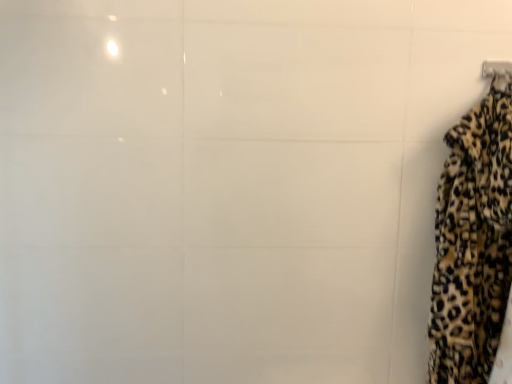
Question: Does leopard print fabric at right have a greater width compared to metallic silver hanger at upper right?

Choices:
 (A) yes
 (B) no

Answer: (A)

Question: Can you confirm if leopard print fabric at right is bigger than metallic silver hanger at upper right?

Choices:
 (A) yes
 (B) no

Answer: (A)

Question: From a real-world perspective, is leopard print fabric at right positioned under metallic silver hanger at upper right based on gravity?

Choices:
 (A) yes
 (B) no

Answer: (A)

Question: Are leopard print fabric at right and metallic silver hanger at upper right far apart?

Choices:
 (A) yes
 (B) no

Answer: (B)

Question: Can you confirm if leopard print fabric at right is positioned to the right of metallic silver hanger at upper right?

Choices:
 (A) yes
 (B) no

Answer: (B)

Question: Is leopard print fabric at right shorter than metallic silver hanger at upper right?

Choices:
 (A) no
 (B) yes

Answer: (A)

Question: From the image's perspective, is metallic silver hanger at upper right on top of leopard print fabric at right?

Choices:
 (A) no
 (B) yes

Answer: (B)

Question: Is metallic silver hanger at upper right outside leopard print fabric at right?

Choices:
 (A) yes
 (B) no

Answer: (B)

Question: Is metallic silver hanger at upper right not close to leopard print fabric at right?

Choices:
 (A) no
 (B) yes

Answer: (A)

Question: Is the position of metallic silver hanger at upper right more distant than that of leopard print fabric at right?

Choices:
 (A) yes
 (B) no

Answer: (A)

Question: Can you confirm if metallic silver hanger at upper right is thinner than leopard print fabric at right?

Choices:
 (A) no
 (B) yes

Answer: (B)

Question: Is metallic silver hanger at upper right oriented away from leopard print fabric at right?

Choices:
 (A) no
 (B) yes

Answer: (B)

Question: Considering the positions of leopard print fabric at right and metallic silver hanger at upper right in the image, is leopard print fabric at right wider or thinner than metallic silver hanger at upper right?

Choices:
 (A) thin
 (B) wide

Answer: (B)